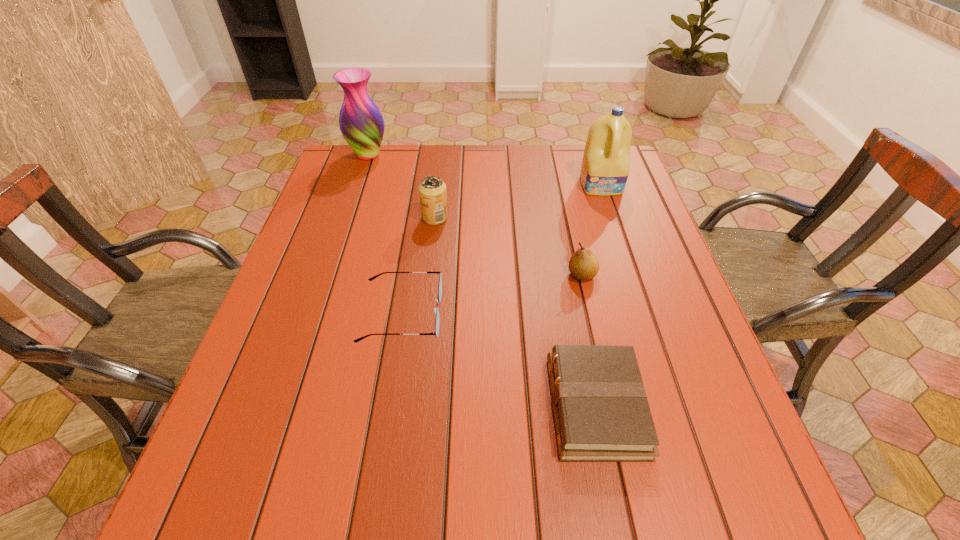
Find the location of a particular element. The width and height of the screenshot is (960, 540). detergent that is at the right edge is located at coordinates (605, 168).

Where is `Bible positioned at the right edge`? The height and width of the screenshot is (540, 960). Bible positioned at the right edge is located at coordinates (601, 411).

Where is `object situated at the far left corner`? This screenshot has height=540, width=960. object situated at the far left corner is located at coordinates (361, 122).

The height and width of the screenshot is (540, 960). I want to click on object located at the far right corner, so click(x=605, y=168).

You are a GUI agent. You are given a task and a screenshot of the screen. Output one action in this format:
    pyautogui.click(x=<x>, y=<y>)
    Task: Click on the free space at the far edge of the desktop
    The height and width of the screenshot is (540, 960).
    Given the screenshot: What is the action you would take?
    pyautogui.click(x=473, y=163)

Where is `vacant region at the near edge of the desktop`? Image resolution: width=960 pixels, height=540 pixels. vacant region at the near edge of the desktop is located at coordinates (563, 502).

I want to click on blank area at the left edge, so click(357, 267).

Identify the location of vacant space at the right edge. pyautogui.click(x=641, y=296).

I want to click on vacant area at the far right corner of the desktop, so click(x=582, y=186).

The height and width of the screenshot is (540, 960). In order to click on vacant region between the vase and the fourth tallest object in this screenshot , I will do `click(475, 215)`.